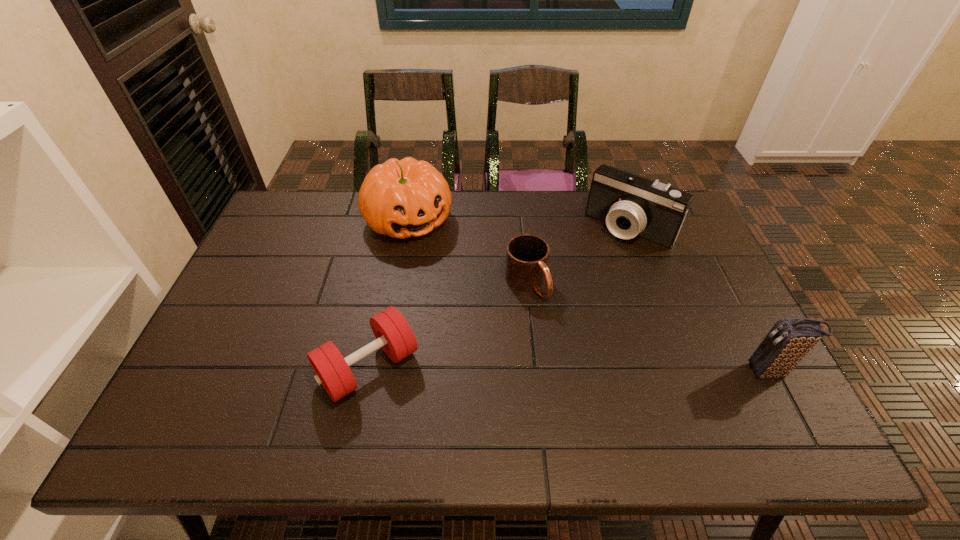
Where is `vacant area that satisfies the following two spatial constraints: 1. on the front side of the clutch bag; 2. with the zip open on the second object from right to left`? This screenshot has width=960, height=540. vacant area that satisfies the following two spatial constraints: 1. on the front side of the clutch bag; 2. with the zip open on the second object from right to left is located at coordinates (682, 372).